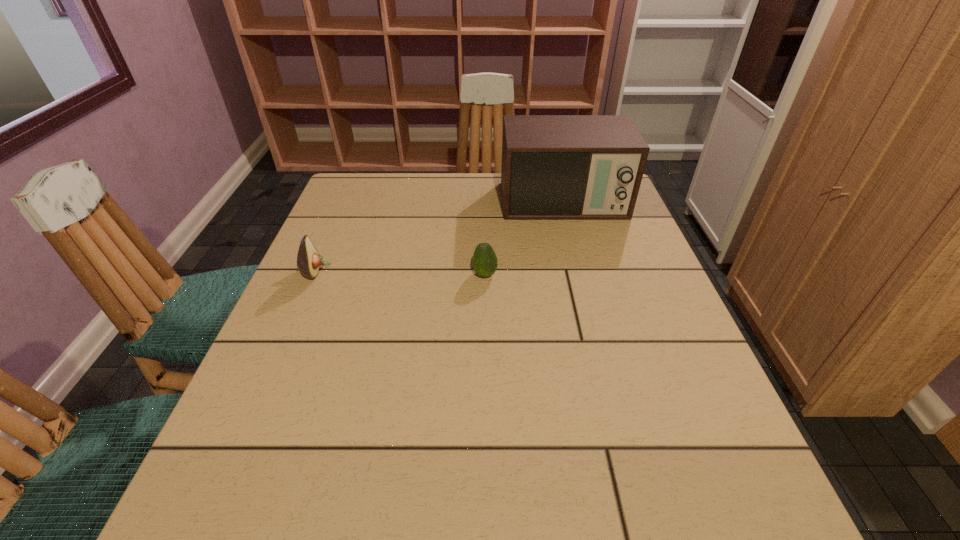
The width and height of the screenshot is (960, 540). Find the location of `free space that satisfies the following two spatial constraints: 1. on the seed side of the leftmost object; 2. on the back side of the shorter avocado`. free space that satisfies the following two spatial constraints: 1. on the seed side of the leftmost object; 2. on the back side of the shorter avocado is located at coordinates (315, 275).

Locate an element on the screen. The width and height of the screenshot is (960, 540). free region that satisfies the following two spatial constraints: 1. on the front-facing side of the farthest object; 2. on the seed side of the left avocado is located at coordinates (581, 271).

Locate an element on the screen. The width and height of the screenshot is (960, 540). vacant position in the image that satisfies the following two spatial constraints: 1. on the front-facing side of the radio receiver; 2. on the seed side of the leftmost object is located at coordinates (581, 271).

You are a GUI agent. You are given a task and a screenshot of the screen. Output one action in this format:
    pyautogui.click(x=<x>, y=<y>)
    Task: Click on the free space that satisfies the following two spatial constraints: 1. on the front-facing side of the radio receiver; 2. on the seed side of the left avocado
    The image size is (960, 540).
    Given the screenshot: What is the action you would take?
    pyautogui.click(x=581, y=271)

Image resolution: width=960 pixels, height=540 pixels. In order to click on free spot that satisfies the following two spatial constraints: 1. on the front-facing side of the rightmost object; 2. on the seed side of the taller avocado in this screenshot , I will do `click(581, 271)`.

You are a GUI agent. You are given a task and a screenshot of the screen. Output one action in this format:
    pyautogui.click(x=<x>, y=<y>)
    Task: Click on the blank area in the image that satisfies the following two spatial constraints: 1. on the front-facing side of the rightmost object; 2. on the seed side of the second tallest object
    The height and width of the screenshot is (540, 960).
    Given the screenshot: What is the action you would take?
    pyautogui.click(x=581, y=271)

This screenshot has width=960, height=540. Identify the location of vacant space that satisfies the following two spatial constraints: 1. on the seed side of the taller avocado; 2. on the right side of the second object from left to right. (315, 275).

In order to click on vacant space that satisfies the following two spatial constraints: 1. on the front-facing side of the radio receiver; 2. on the seed side of the taller avocado in this screenshot , I will do `click(581, 271)`.

You are a GUI agent. You are given a task and a screenshot of the screen. Output one action in this format:
    pyautogui.click(x=<x>, y=<y>)
    Task: Click on the free space that satisfies the following two spatial constraints: 1. on the back side of the shortest object; 2. on the seed side of the left avocado
    The image size is (960, 540).
    Given the screenshot: What is the action you would take?
    pyautogui.click(x=485, y=271)